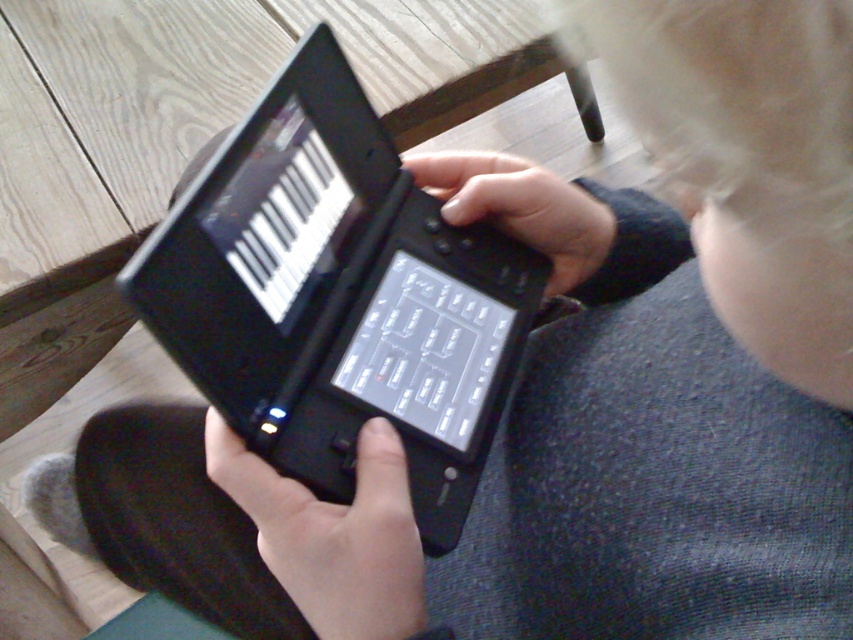
How much distance is there between black matte laptop at center and black matte hand at center?

black matte laptop at center and black matte hand at center are 3.49 inches apart.

Does black matte laptop at center lie in front of black matte hand at center?

Yes.

Does point (173, 259) lie behind point (450, 192)?

No, (173, 259) is in front of (450, 192).

You are a GUI agent. You are given a task and a screenshot of the screen. Output one action in this format:
    pyautogui.click(x=<x>, y=<y>)
    Task: Click on the black matte laptop at center
    The height and width of the screenshot is (640, 853).
    Given the screenshot: What is the action you would take?
    pyautogui.click(x=337, y=296)

Find the location of a particular element. This screenshot has height=640, width=853. black matte button at center is located at coordinates (334, 536).

Consider the image. Is black matte button at center wider than black matte hand at center?

No, black matte button at center is not wider than black matte hand at center.

Find the location of a particular element. Image resolution: width=853 pixels, height=640 pixels. black matte button at center is located at coordinates (334, 536).

Based on the photo, can you confirm if black matte laptop at center is wider than black matte button at center?

Correct, the width of black matte laptop at center exceeds that of black matte button at center.

From the picture: Is black matte laptop at center to the left of black matte button at center from the viewer's perspective?

No, black matte laptop at center is not to the left of black matte button at center.

Is point (297, 83) positioned before point (366, 548)?

That is False.

I want to click on black matte laptop at center, so click(x=337, y=296).